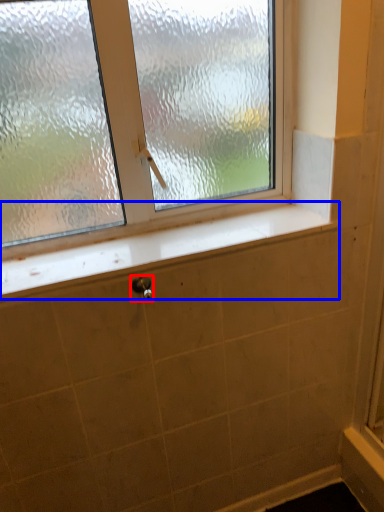
Question: Among these objects, which one is nearest to the camera, shower (highlighted by a red box) or window sill (highlighted by a blue box)?

Choices:
 (A) shower
 (B) window sill

Answer: (B)